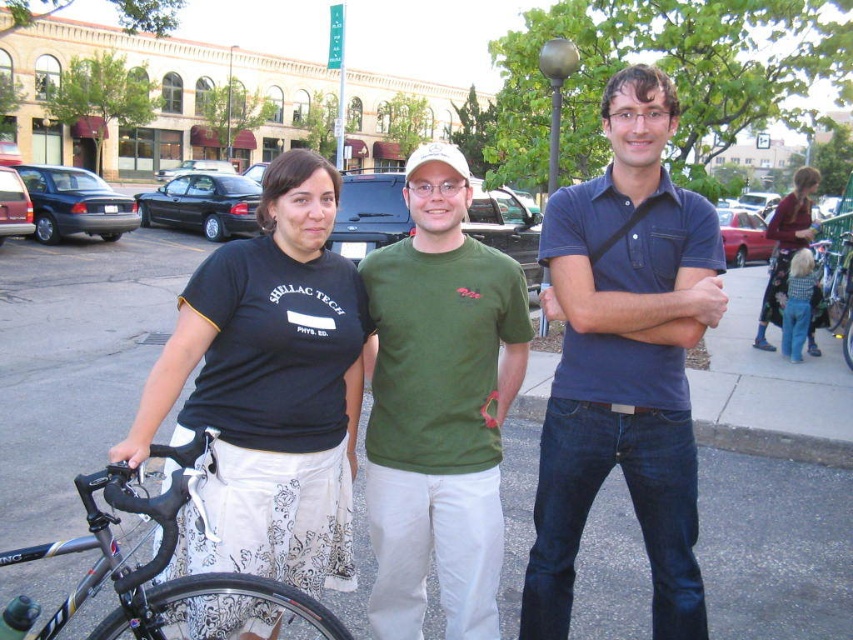
Question: Does black asphalt pavement at center appear over shiny black bicycle at lower left?

Choices:
 (A) no
 (B) yes

Answer: (B)

Question: Which of the following is the closest to the observer?

Choices:
 (A) black asphalt pavement at center
 (B) blue cotton polo shirt at center
 (C) floral skirt at right

Answer: (B)

Question: Among these objects, which one is nearest to the camera?

Choices:
 (A) black asphalt pavement at center
 (B) green cotton t-shirt at center
 (C) blue cotton polo shirt at center
 (D) black cotton shirt at center

Answer: (D)

Question: Does black asphalt pavement at center appear on the right side of floral skirt at right?

Choices:
 (A) yes
 (B) no

Answer: (B)

Question: Among these objects, which one is nearest to the camera?

Choices:
 (A) blue cotton polo shirt at center
 (B) green cotton t-shirt at center

Answer: (A)

Question: Does shiny black bicycle at lower left appear on the left side of floral skirt at right?

Choices:
 (A) yes
 (B) no

Answer: (A)